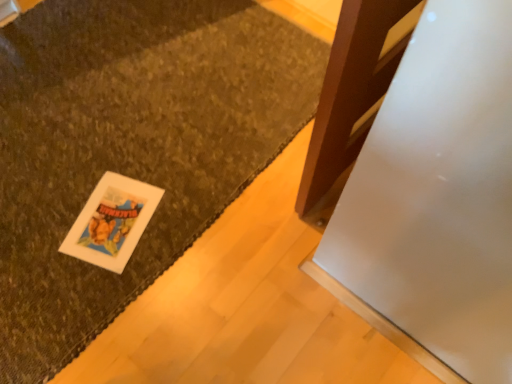
What are the coordinates of `vacant area that is situated to the right of white matte card at lower left` in the screenshot? It's located at (182, 222).